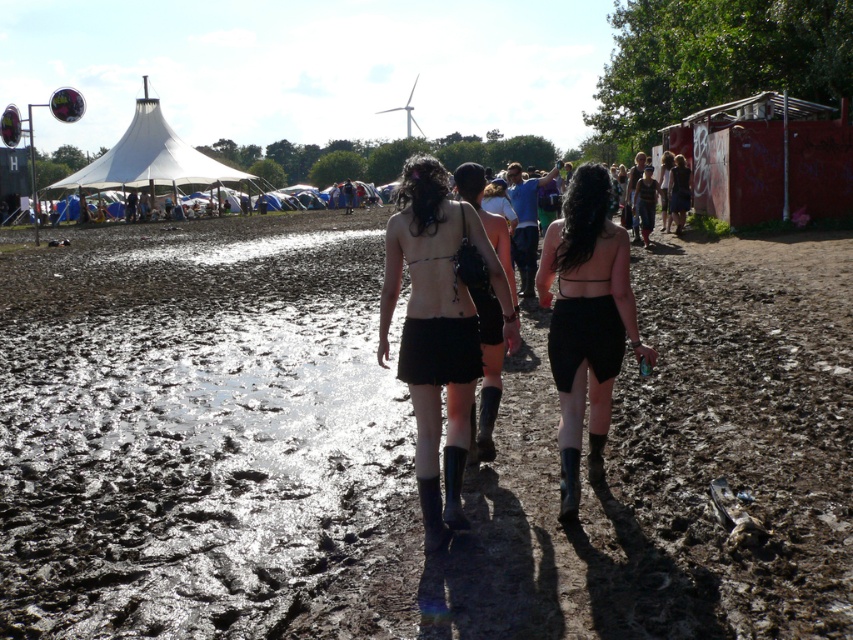
You are standing at the origin point of the coordinate system. You want to walk to the matte black skirt at center. Which direction should you go?

Since the matte black skirt at center is located at coordinate point (438,330), you should move in the positive x and y direction to reach it.

You are standing at the center of the festival grounds and notice a matte black skirt at center located at point (438, 330). If you walk straight ahead, will you reach the large white tent structure to the left before encountering the matte black skirt at center?

The matte black skirt at center is located at point (438, 330), which is directly in front of you at the center. The large white tent structure is to the left. Walking straight ahead, you will first encounter the matte black skirt at center before reaching the tent to the left.

You are navigating through the festival grounds and need to avoid getting your shoes too dirty. Where exactly is the muddy wet ground at center located in the scene?

The muddy wet ground at center is located at point 0.700 in the x coordinate and 0.476 in the y coordinate.